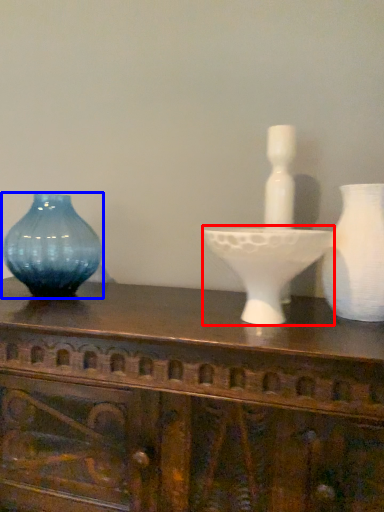
Question: Which of the following is the closest to the observer, candle holder (highlighted by a red box) or vase (highlighted by a blue box)?

Choices:
 (A) candle holder
 (B) vase

Answer: (A)